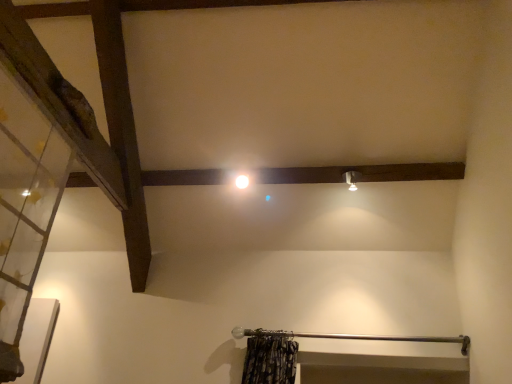
What is the approximate width of metallic curtain rod at lower center?

The width of metallic curtain rod at lower center is 7.05 inches.

At what (x,y) coordinates should I click in order to perform the action: click on white glossy light at center. Please return your answer as a coordinate pair (x, y). Looking at the image, I should click on (242, 181).

Does white glossy light at center have a greater width compared to metallic curtain rod at lower center?

No, white glossy light at center is not wider than metallic curtain rod at lower center.

How many degrees apart are the facing directions of white glossy light at center and metallic curtain rod at lower center?

white glossy light at center and metallic curtain rod at lower center are facing 1.25 degrees away from each other.

From a real-world perspective, is white glossy light at center above or below metallic curtain rod at lower center?

In terms of real-world spatial position, white glossy light at center is above metallic curtain rod at lower center.

Is white glossy light at center with metallic curtain rod at lower center?

No, white glossy light at center is not in contact with metallic curtain rod at lower center.

Between matte silver light fixture at upper right and transparent glass door at left, which one has larger size?

With larger size is transparent glass door at left.

From a real-world perspective, is matte silver light fixture at upper right on top of transparent glass door at left?

Indeed, from a real-world perspective, matte silver light fixture at upper right stands above transparent glass door at left.

Considering the sizes of objects matte silver light fixture at upper right and transparent glass door at left in the image provided, who is shorter, matte silver light fixture at upper right or transparent glass door at left?

Standing shorter between the two is matte silver light fixture at upper right.

Considering the points (351, 173) and (10, 144), which point is behind, point (351, 173) or point (10, 144)?

Positioned behind is point (351, 173).

Is matte silver light fixture at upper right placed right next to metallic curtain rod at lower center?

No, matte silver light fixture at upper right is not with metallic curtain rod at lower center.

From a real-world perspective, between matte silver light fixture at upper right and metallic curtain rod at lower center, who is vertically higher?

matte silver light fixture at upper right.

Is matte silver light fixture at upper right located outside metallic curtain rod at lower center?

Absolutely, matte silver light fixture at upper right is external to metallic curtain rod at lower center.

Can you tell me how much matte silver light fixture at upper right and metallic curtain rod at lower center differ in facing direction?

1.25 degrees separate the facing orientations of matte silver light fixture at upper right and metallic curtain rod at lower center.

Which is less distant, (355, 178) or (244, 176)?

Point (355, 178).

From the image's perspective, which one is positioned lower, matte silver light fixture at upper right or white glossy light at center?

From the image's view, matte silver light fixture at upper right is below.

Consider the image. From the image's perspective, is transparent glass door at left located above matte silver light fixture at upper right?

Incorrect, from the image's perspective, transparent glass door at left is lower than matte silver light fixture at upper right.

At what (x,y) coordinates should I click in order to perform the action: click on light fixture behind the transparent glass door at left. Please return your answer as a coordinate pair (x, y). The width and height of the screenshot is (512, 384). Looking at the image, I should click on (352, 179).

Based on their sizes in the image, would you say transparent glass door at left is bigger or smaller than matte silver light fixture at upper right?

Clearly, transparent glass door at left is larger in size than matte silver light fixture at upper right.

Between transparent glass door at left and matte silver light fixture at upper right, which one appears on the left side from the viewer's perspective?

Positioned to the left is transparent glass door at left.

Does metallic curtain rod at lower center contain transparent glass door at left?

That's incorrect, transparent glass door at left is not inside metallic curtain rod at lower center.

Locate an element on the screen. This screenshot has height=384, width=512. glass door above the metallic curtain rod at lower center (from the image's perspective) is located at coordinates (24, 208).

From a real-world perspective, who is located higher, metallic curtain rod at lower center or transparent glass door at left?

transparent glass door at left, from a real-world perspective.

Are metallic curtain rod at lower center and transparent glass door at left far apart?

metallic curtain rod at lower center is positioned a significant distance from transparent glass door at left.

What are the coordinates of `light fixture above the metallic curtain rod at lower center (from a real-world perspective)` in the screenshot? It's located at (352, 179).

From a real-world perspective, relative to matte silver light fixture at upper right, is metallic curtain rod at lower center vertically above or below?

metallic curtain rod at lower center is situated lower than matte silver light fixture at upper right in the real world.

Is metallic curtain rod at lower center looking in the opposite direction of matte silver light fixture at upper right?

No, metallic curtain rod at lower center is not facing the opposite direction of matte silver light fixture at upper right.

Identify the location of beam in front of the white glossy light at center. The width and height of the screenshot is (512, 384). (353, 337).

The height and width of the screenshot is (384, 512). I want to click on light fixture above the transparent glass door at left (from the image's perspective), so click(x=352, y=179).

Estimate the real-world distances between objects in this image. Which object is closer to white glossy light at center, transparent glass door at left or metallic curtain rod at lower center?

metallic curtain rod at lower center.

When comparing their distances from white glossy light at center, does matte silver light fixture at upper right or transparent glass door at left seem closer?

matte silver light fixture at upper right is closer to white glossy light at center.

Considering their positions, is white glossy light at center positioned closer to matte silver light fixture at upper right than transparent glass door at left?

white glossy light at center is positioned closer to the anchor matte silver light fixture at upper right.

Looking at the image, which one is located closer to metallic curtain rod at lower center, white glossy light at center or transparent glass door at left?

The object closer to metallic curtain rod at lower center is white glossy light at center.

Which object lies further to the anchor point metallic curtain rod at lower center, transparent glass door at left or matte silver light fixture at upper right?

Based on the image, transparent glass door at left appears to be further to metallic curtain rod at lower center.

From the image, which object appears to be farther from white glossy light at center, metallic curtain rod at lower center or transparent glass door at left?

Based on the image, transparent glass door at left appears to be further to white glossy light at center.

Which object lies further to the anchor point transparent glass door at left, white glossy light at center or metallic curtain rod at lower center?

metallic curtain rod at lower center.

Estimate the real-world distances between objects in this image. Which object is further from matte silver light fixture at upper right, white glossy light at center or metallic curtain rod at lower center?

metallic curtain rod at lower center.

The width and height of the screenshot is (512, 384). Find the location of `light fixture between transparent glass door at left and white glossy light at center in the front-back direction`. light fixture between transparent glass door at left and white glossy light at center in the front-back direction is located at coordinates (352, 179).

This screenshot has height=384, width=512. In order to click on beam between transparent glass door at left and white glossy light at center in the front-back direction in this screenshot , I will do `click(353, 337)`.

I want to click on light fixture between white glossy light at center and metallic curtain rod at lower center vertically, so pos(352,179).

Locate an element on the screen. The height and width of the screenshot is (384, 512). beam between transparent glass door at left and matte silver light fixture at upper right in the front-back direction is located at coordinates (353, 337).